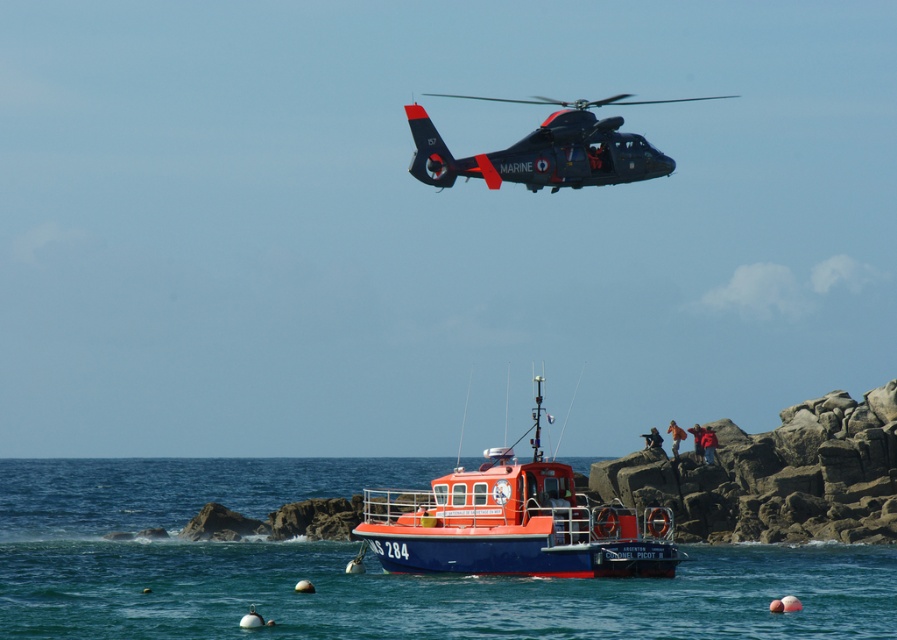
Is orange glossy boat at center taller than matte black helicopter at upper center?

No.

Does point (475, 516) come behind point (643, 147)?

No, (475, 516) is in front of (643, 147).

What do you see at coordinates (512, 524) in the screenshot? I see `orange glossy boat at center` at bounding box center [512, 524].

In order to click on orange glossy boat at center in this screenshot , I will do coord(512,524).

This screenshot has height=640, width=897. I want to click on blue water at boat center, so click(x=366, y=566).

Between blue water at boat center and orange glossy boat at center, which one is positioned lower?

blue water at boat center is lower down.

The image size is (897, 640). What are the coordinates of `blue water at boat center` in the screenshot? It's located at (366, 566).

Who is positioned more to the left, blue water at boat center or matte black helicopter at upper center?

From the viewer's perspective, blue water at boat center appears more on the left side.

Does blue water at boat center appear on the left side of matte black helicopter at upper center?

Correct, you'll find blue water at boat center to the left of matte black helicopter at upper center.

Does point (319, 600) come farther from viewer compared to point (412, 104)?

No, it is in front of (412, 104).

What are the coordinates of `blue water at boat center` in the screenshot? It's located at (366, 566).